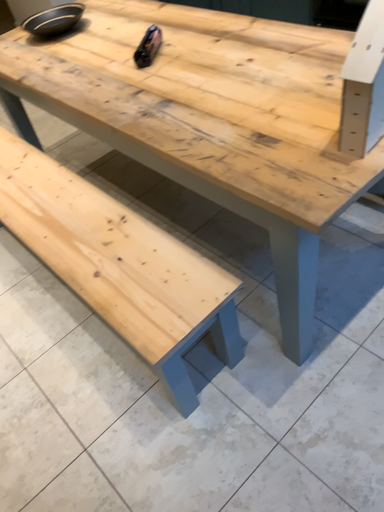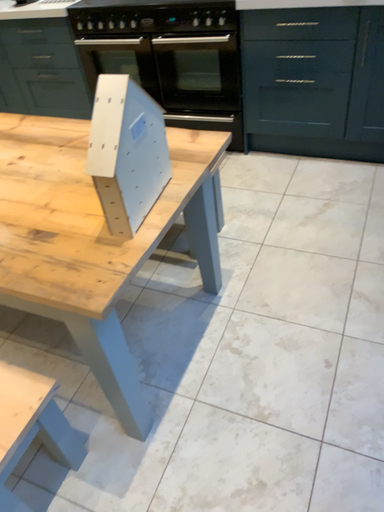
Question: Which way did the camera rotate in the video?

Choices:
 (A) rotated right
 (B) rotated left

Answer: (A)